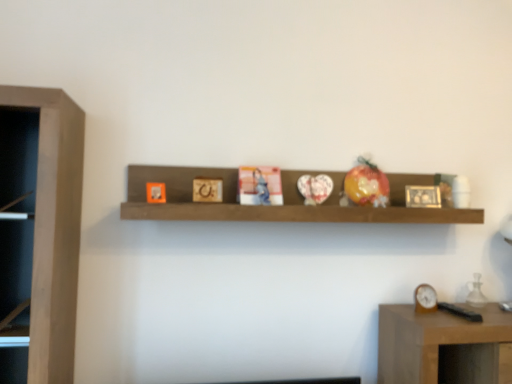
Question: In terms of height, does wooden picture frame at center look taller or shorter compared to brown wooden shelf at center?

Choices:
 (A) tall
 (B) short

Answer: (B)

Question: Looking at their shapes, would you say wooden picture frame at center is wider or thinner than brown wooden shelf at center?

Choices:
 (A) wide
 (B) thin

Answer: (B)

Question: Considering the real-world distances, which object is closest to the brown wooden shelf at center?

Choices:
 (A) wooden picture frame at center
 (B) brown wooden clock at right

Answer: (A)

Question: Which object is positioned farthest from the wooden picture frame at center?

Choices:
 (A) brown wooden shelf at center
 (B) brown wooden clock at right

Answer: (A)